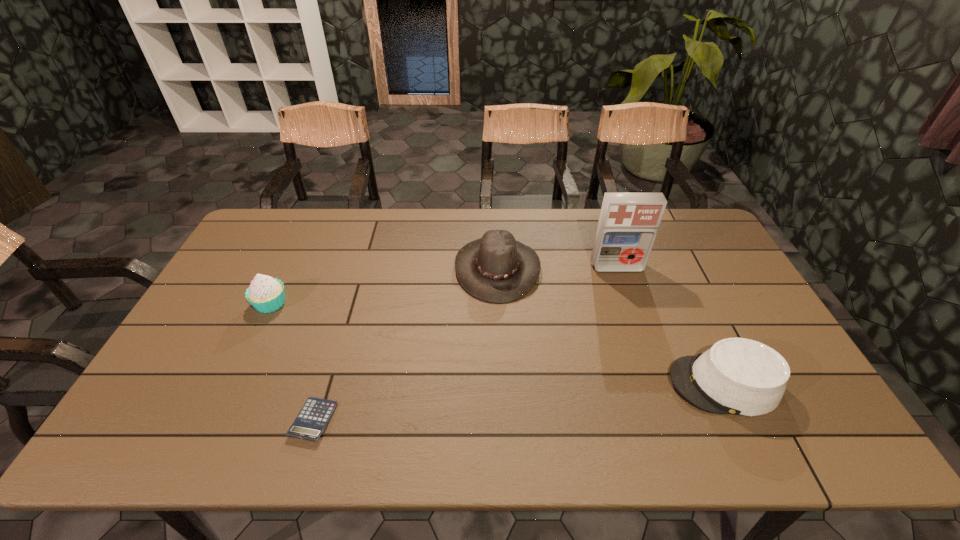
Locate an element on the screen. the tallest object is located at coordinates (628, 223).

Locate an element on the screen. The height and width of the screenshot is (540, 960). the leftmost object is located at coordinates (266, 294).

In order to click on the third object from right to left in this screenshot , I will do `click(496, 268)`.

Identify the location of the farther hat. (496, 268).

Identify the location of the right hat. (738, 376).

Find the location of a particular element. the nearer hat is located at coordinates (738, 376).

Locate an element on the screen. The image size is (960, 540). the shortest object is located at coordinates (310, 423).

The image size is (960, 540). In order to click on calculator in this screenshot , I will do `click(310, 423)`.

Identify the location of vacant region located 0.270m on the front-facing side of the tallest object. Image resolution: width=960 pixels, height=540 pixels. (641, 339).

I want to click on blank area located 0.120m on the right of the leftmost object, so click(x=328, y=303).